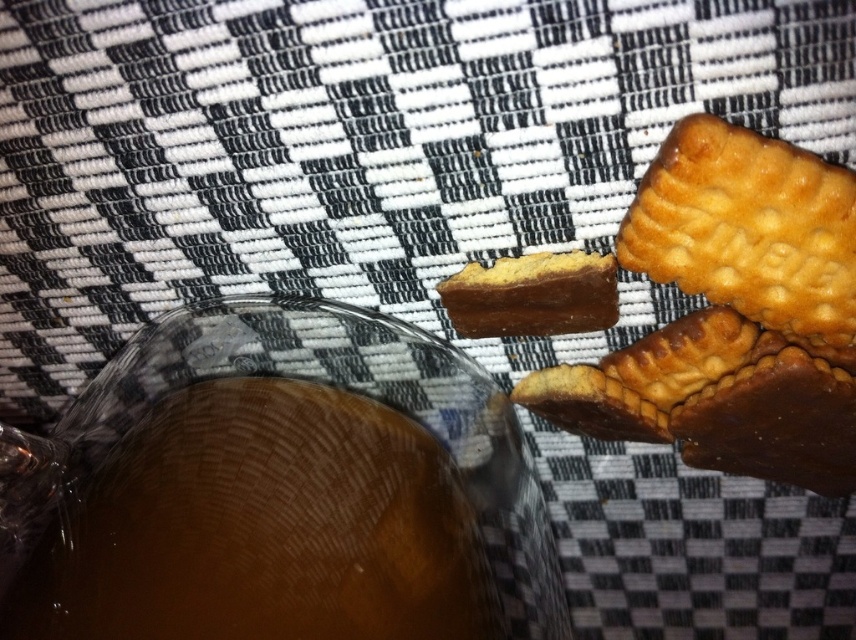
Question: Can you confirm if golden textured cookie at upper right is thinner than chocolate-coated cookie at center?

Choices:
 (A) no
 (B) yes

Answer: (A)

Question: Does golden textured cookie at upper right have a larger size compared to chocolate-coated cookie at center?

Choices:
 (A) yes
 (B) no

Answer: (A)

Question: Which object is farther from the camera taking this photo?

Choices:
 (A) chocolate-coated cookie at center
 (B) golden textured cookie at upper right

Answer: (A)

Question: Where is golden textured cookie at upper right located in relation to chocolate-coated cookie at center in the image?

Choices:
 (A) above
 (B) below

Answer: (A)

Question: Among these objects, which one is nearest to the camera?

Choices:
 (A) chocolate-coated cookie at center
 (B) golden textured cookie at upper right

Answer: (B)